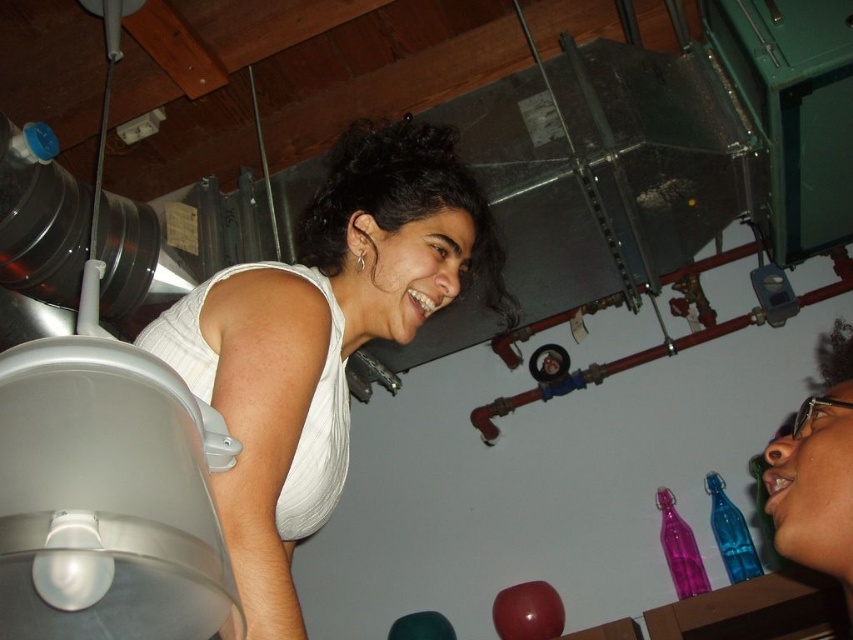
Can you confirm if white matte tank top at upper left is smaller than translucent purple glass bottle at lower right?

No, white matte tank top at upper left is not smaller than translucent purple glass bottle at lower right.

Between white matte tank top at upper left and translucent purple glass bottle at lower right, which one has less height?

translucent purple glass bottle at lower right

Between point (257, 444) and point (689, 556), which one is positioned behind?

The point (689, 556) is behind.

Where is `white matte tank top at upper left`? The height and width of the screenshot is (640, 853). white matte tank top at upper left is located at coordinates (323, 337).

Does matte black glasses at lower right have a greater height compared to translucent blue glass bottle at lower right?

Indeed, matte black glasses at lower right has a greater height compared to translucent blue glass bottle at lower right.

Which is in front, point (788, 552) or point (717, 493)?

Positioned in front is point (788, 552).

Identify the location of matte black glasses at lower right. (817, 468).

Does white matte tank top at upper left come in front of translucent blue glass bottle at lower right?

Yes.

Locate an element on the screen. The image size is (853, 640). white matte tank top at upper left is located at coordinates (323, 337).

Does point (467, 227) lie behind point (730, 556)?

No, (467, 227) is closer to viewer.

Locate an element on the screen. white matte tank top at upper left is located at coordinates (323, 337).